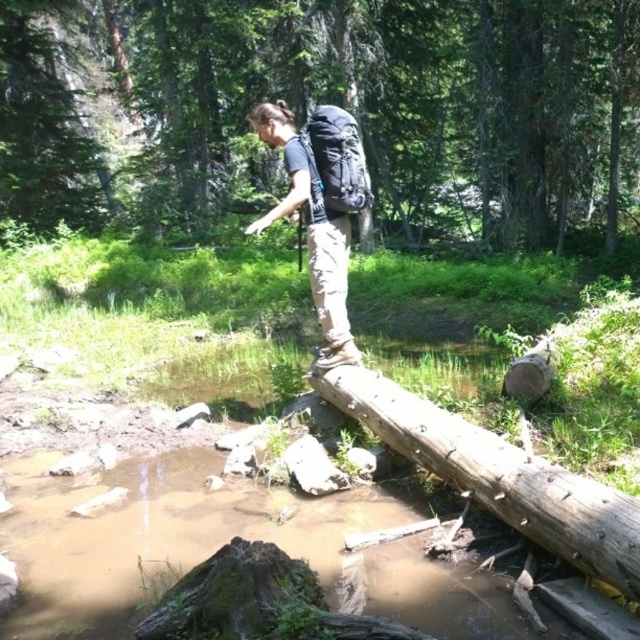
Question: Which point appears closest to the camera in this image?

Choices:
 (A) (294, 188)
 (B) (92, 96)
 (C) (541, 476)

Answer: (C)

Question: Can you confirm if brown rough log at center is positioned to the left of brown rough wood log at center?

Choices:
 (A) no
 (B) yes

Answer: (B)

Question: Estimate the real-world distances between objects in this image. Which object is farther from the brown rough log at center?

Choices:
 (A) brown rough wood log at center
 (B) matte black backpack at center

Answer: (B)

Question: Which of the following is the closest to the observer?

Choices:
 (A) brown rough wood log at center
 (B) brown rough log at center
 (C) matte black backpack at center

Answer: (A)

Question: Is brown rough log at center to the right of matte black backpack at center from the viewer's perspective?

Choices:
 (A) no
 (B) yes

Answer: (A)

Question: Is brown rough log at center above brown rough wood log at center?

Choices:
 (A) no
 (B) yes

Answer: (B)